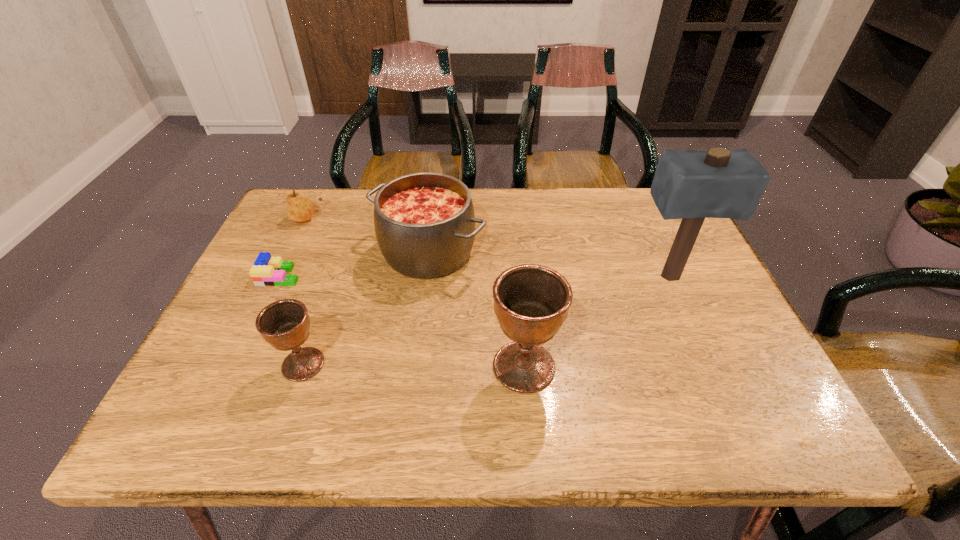
The height and width of the screenshot is (540, 960). In order to click on object located in the far left corner section of the desktop in this screenshot , I will do `click(299, 208)`.

In the image, there is a desktop. What are the coordinates of `free space at the far edge` in the screenshot? It's located at (520, 199).

Locate an element on the screen. Image resolution: width=960 pixels, height=540 pixels. free location at the near edge is located at coordinates pos(545,397).

In the image, there is a desktop. Where is `vacant space at the right edge`? vacant space at the right edge is located at coordinates (691, 253).

The width and height of the screenshot is (960, 540). In order to click on free spot at the near left corner of the desktop in this screenshot , I will do `click(184, 393)`.

Locate an element on the screen. This screenshot has width=960, height=540. vacant space at the far right corner of the desktop is located at coordinates (660, 225).

Find the location of a particular element. The height and width of the screenshot is (540, 960). empty location between the shortest object and the casserole is located at coordinates (354, 264).

Identify the location of empty space that is in between the second object from right to left and the Lego. The width and height of the screenshot is (960, 540). (402, 321).

You are a GUI agent. You are given a task and a screenshot of the screen. Output one action in this format:
    pyautogui.click(x=<x>, y=<y>)
    Task: Click on the free spot between the taller chalice and the pear
    
    Given the screenshot: What is the action you would take?
    pyautogui.click(x=415, y=292)

Image resolution: width=960 pixels, height=540 pixels. I want to click on free space between the fifth object from left to right and the Lego, so click(x=402, y=321).